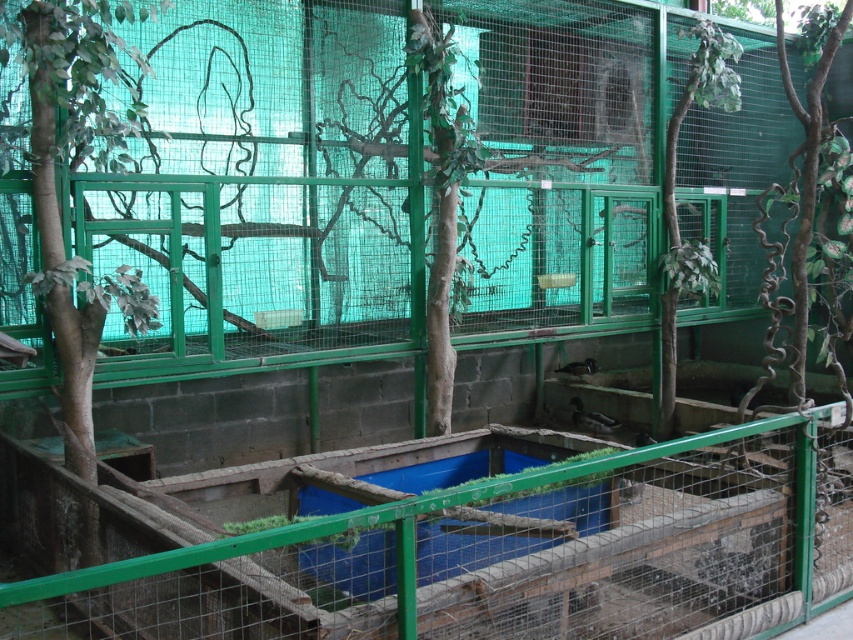
Is green wire mesh at lower center above brown matte bird at lower center?

Actually, green wire mesh at lower center is below brown matte bird at lower center.

Does point (498, 536) lie in front of point (579, 401)?

Yes, point (498, 536) is in front of point (579, 401).

Who is more distant from viewer, (x=299, y=570) or (x=606, y=422)?

The point (x=606, y=422) is behind.

Where is `green wire mesh at lower center`? Image resolution: width=853 pixels, height=640 pixels. green wire mesh at lower center is located at coordinates (491, 554).